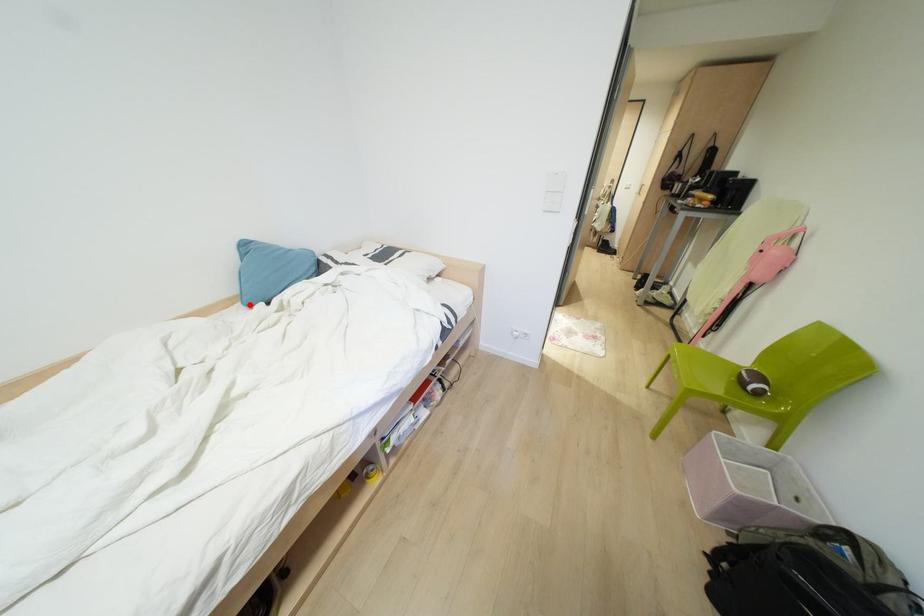
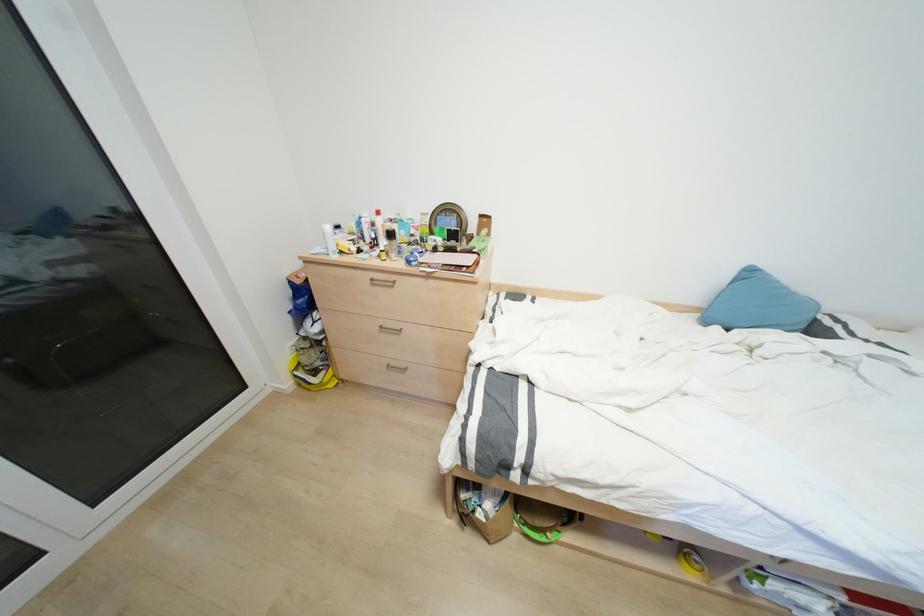
Locate, in the second image, the point that corresponds to the highlighted location in the first image.

(704, 322)